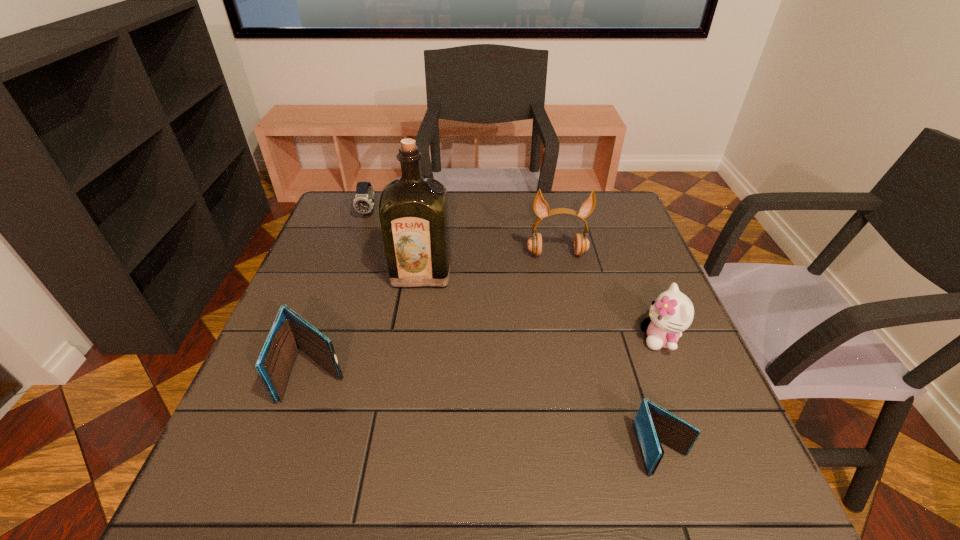
Where is `the second closest object to the earphone`? the second closest object to the earphone is located at coordinates pos(671,313).

You are a GUI agent. You are given a task and a screenshot of the screen. Output one action in this format:
    pyautogui.click(x=<x>, y=<y>)
    Task: Click on the fourth closest object to the shortest object
    The image size is (960, 540).
    Given the screenshot: What is the action you would take?
    pyautogui.click(x=290, y=332)

Image resolution: width=960 pixels, height=540 pixels. Find the location of `vacant space that satisfies the following two spatial constraints: 1. on the front-facing side of the kitten; 2. on the exterior surface of the right wallet`. vacant space that satisfies the following two spatial constraints: 1. on the front-facing side of the kitten; 2. on the exterior surface of the right wallet is located at coordinates (706, 450).

The width and height of the screenshot is (960, 540). What are the coordinates of `free space in the image that satisfies the following two spatial constraints: 1. on the front-facing side of the kitten; 2. on the exterior surface of the taller wallet` in the screenshot? It's located at (675, 374).

This screenshot has height=540, width=960. Identify the location of vacant space that satisfies the following two spatial constraints: 1. on the front-facing side of the kitten; 2. on the exterior surface of the taller wallet. (675, 374).